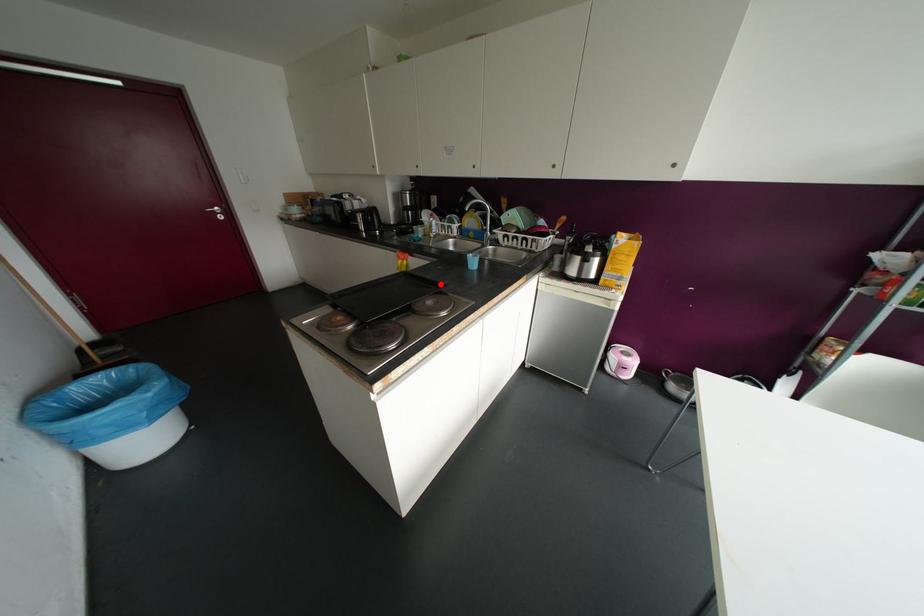
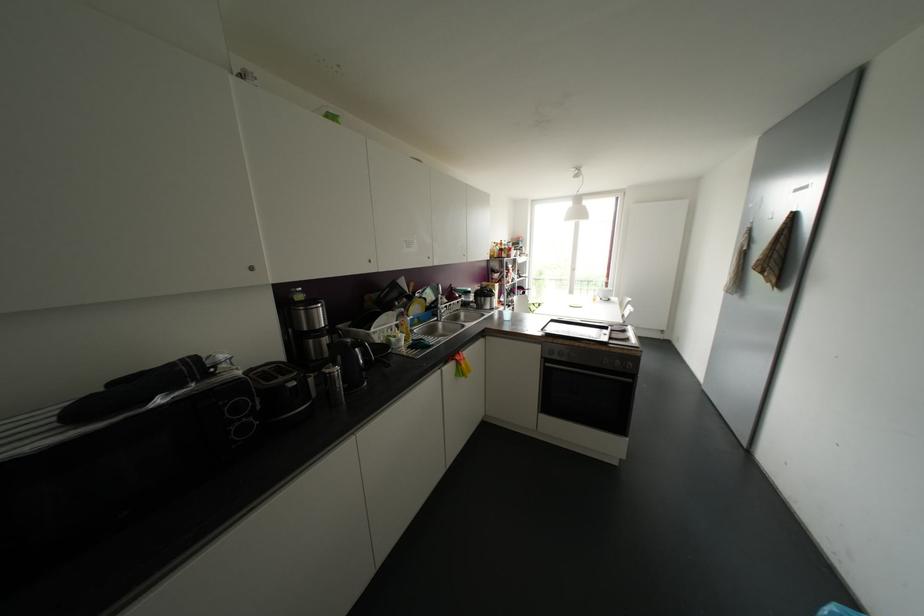
Find the pixel in the second image that matches the highlighted location in the first image.

(553, 317)